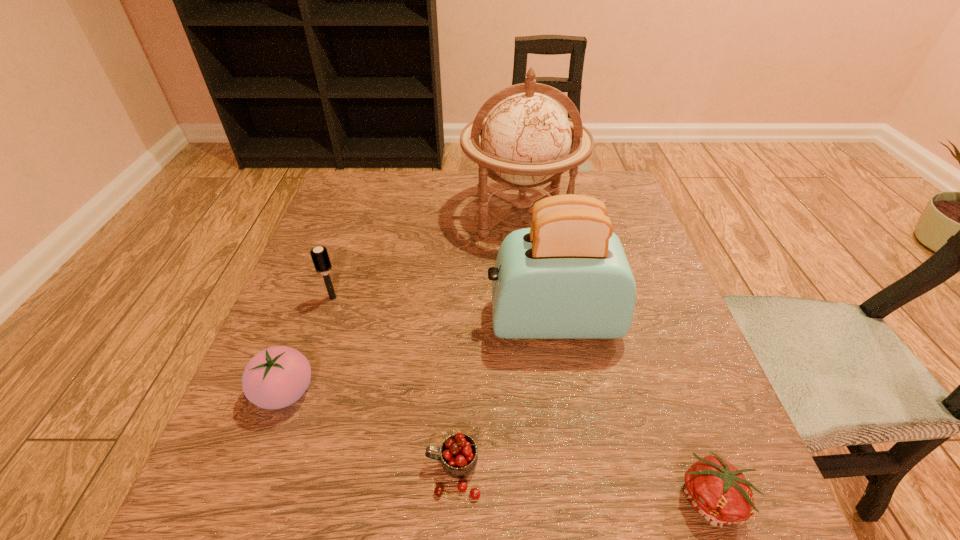
Identify the location of the farthest object. This screenshot has height=540, width=960. (526, 139).

Identify the location of the tallest object. The image size is (960, 540). (526, 139).

The height and width of the screenshot is (540, 960). What are the coordinates of `toaster` in the screenshot? It's located at (567, 277).

The height and width of the screenshot is (540, 960). I want to click on hairbrush, so click(x=319, y=255).

The image size is (960, 540). Find the location of `the fourth farthest object`. the fourth farthest object is located at coordinates click(x=276, y=377).

Locate an element on the screen. The image size is (960, 540). the left tomato is located at coordinates (276, 377).

You are a GUI agent. You are given a task and a screenshot of the screen. Output one action in this format:
    pyautogui.click(x=<x>, y=<y>)
    Task: Click on the cherry
    The height and width of the screenshot is (540, 960).
    Given the screenshot: What is the action you would take?
    pyautogui.click(x=459, y=456)

The width and height of the screenshot is (960, 540). Identify the location of the right tomato. (718, 491).

At what (x,y) coordinates should I click in order to perform the action: click on the nearer tomato. Please return your answer as a coordinate pair (x, y). The image size is (960, 540). Looking at the image, I should click on (718, 491).

Locate an element on the screen. free space located at the front of the farthest object showing Africa is located at coordinates (537, 349).